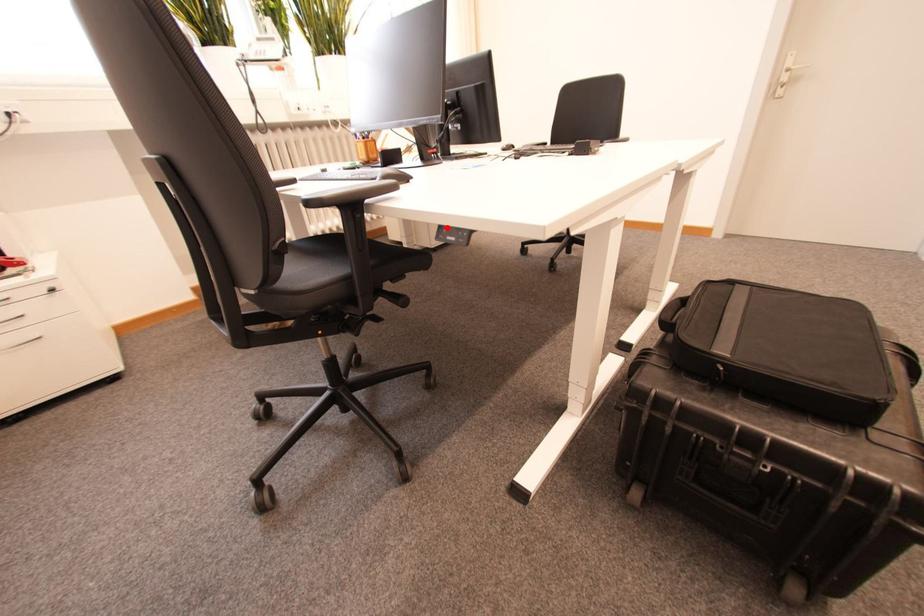
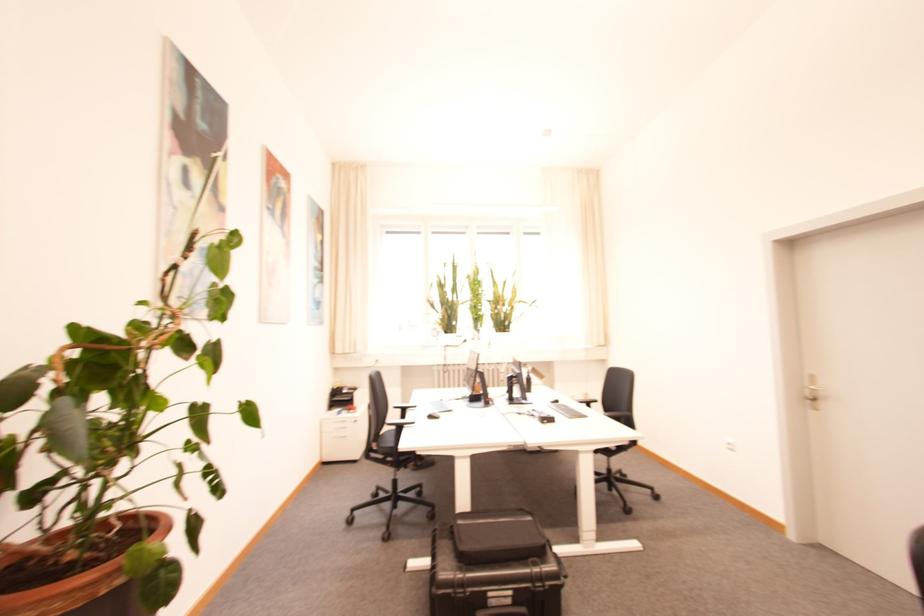
Question: I am providing you with two images of the same scene from different viewpoints. A red point is marked on the first image. Can you still see the location of the red point in image 2?

Choices:
 (A) Yes
 (B) No

Answer: (B)